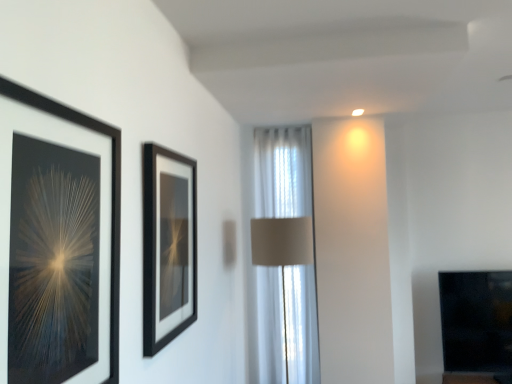
This screenshot has height=384, width=512. What do you see at coordinates (477, 322) in the screenshot? I see `black glass fireplace at lower right` at bounding box center [477, 322].

Measure the distance between point (469, 369) and camera.

Point (469, 369) is 3.05 meters from camera.

What do you see at coordinates (168, 246) in the screenshot? The width and height of the screenshot is (512, 384). I see `black matte picture frame at center, which is the 1th picture frame from right to left` at bounding box center [168, 246].

You are a GUI agent. You are given a task and a screenshot of the screen. Output one action in this format:
    pyautogui.click(x=<x>, y=<y>)
    Task: Click on the black matte picture frame at center, which is the 2th picture frame from left to right
    
    Given the screenshot: What is the action you would take?
    168,246

The width and height of the screenshot is (512, 384). Find the location of `black matte picture frame at left, placed as the first picture frame when sorted from front to back`. black matte picture frame at left, placed as the first picture frame when sorted from front to back is located at coordinates (57, 242).

Identify the location of white sheer curtain at center. (283, 172).

Identify the location of black glass fireplace at lower right. Image resolution: width=512 pixels, height=384 pixels. (477, 322).

Is white sheer curtain at center not close to black matte picture frame at left, the 1th picture frame positioned from the left?

Yes, white sheer curtain at center and black matte picture frame at left, the 1th picture frame positioned from the left, are quite far apart.

From a real-world perspective, which is physically below, white sheer curtain at center or black matte picture frame at left, the 1th picture frame positioned from the left?

In real-world perspective, white sheer curtain at center is lower.

Could you tell me if white sheer curtain at center is turned towards black matte picture frame at left, marked as the second picture frame in a back-to-front arrangement?

Yes, white sheer curtain at center is turned towards black matte picture frame at left, marked as the second picture frame in a back-to-front arrangement.

Can you confirm if white sheer curtain at center is wider than black matte picture frame at center, which is the 2th picture frame from left to right?

Indeed, white sheer curtain at center has a greater width compared to black matte picture frame at center, which is the 2th picture frame from left to right.

In the scene shown: Is white sheer curtain at center placed right next to black matte picture frame at center, which is the 2th picture frame from left to right?

No, white sheer curtain at center is not making contact with black matte picture frame at center, which is the 2th picture frame from left to right.

Is white sheer curtain at center closer to camera compared to black matte picture frame at center, which is the 2th picture frame from left to right?

No, white sheer curtain at center is further to the viewer.

Looking at this image, from a real-world perspective, is black glass fireplace at lower right on white sheer curtain at center?

No.

Is white sheer curtain at center at the back of black glass fireplace at lower right?

No.

Is black glass fireplace at lower right positioned beyond the bounds of white sheer curtain at center?

black glass fireplace at lower right lies outside white sheer curtain at center's area.

How distant is black glass fireplace at lower right from white sheer curtain at center?

black glass fireplace at lower right is 1.23 meters from white sheer curtain at center.

Is black matte picture frame at center, which is the 2th picture frame from left to right, to the right of black glass fireplace at lower right from the viewer's perspective?

Incorrect, black matte picture frame at center, which is the 2th picture frame from left to right, is not on the right side of black glass fireplace at lower right.

Is black matte picture frame at center, which is the 2th picture frame from left to right, inside the boundaries of black glass fireplace at lower right, or outside?

black matte picture frame at center, which is the 2th picture frame from left to right, lies outside black glass fireplace at lower right.

Which of these two, black matte picture frame at center, placed as the first picture frame when sorted from back to front, or black glass fireplace at lower right, is thinner?

With smaller width is black matte picture frame at center, placed as the first picture frame when sorted from back to front.

From a real-world perspective, which object stands above the other?

In real-world perspective, black matte picture frame at center, the 2th picture frame in the front-to-back sequence, is above.

Is the depth of black matte picture frame at center, placed as the first picture frame when sorted from back to front, greater than that of white sheer curtain at center?

That is False.

Can you confirm if black matte picture frame at center, the 2th picture frame in the front-to-back sequence, is taller than white sheer curtain at center?

No.

From the image's perspective, is black glass fireplace at lower right below black matte picture frame at center, the 2th picture frame in the front-to-back sequence?

Indeed, from the image's perspective, black glass fireplace at lower right is shown beneath black matte picture frame at center, the 2th picture frame in the front-to-back sequence.

Considering the positions of objects black glass fireplace at lower right and black matte picture frame at center, placed as the first picture frame when sorted from back to front, in the image provided, who is behind, black glass fireplace at lower right or black matte picture frame at center, placed as the first picture frame when sorted from back to front,?

Positioned behind is black glass fireplace at lower right.

Does black glass fireplace at lower right have a smaller size compared to black matte picture frame at center, which is the 2th picture frame from left to right?

Actually, black glass fireplace at lower right might be larger than black matte picture frame at center, which is the 2th picture frame from left to right.

From the picture: Is black glass fireplace at lower right aimed at black matte picture frame at center, which is the 1th picture frame from right to left?

No, black glass fireplace at lower right is not oriented towards black matte picture frame at center, which is the 1th picture frame from right to left.

Between black glass fireplace at lower right and black matte picture frame at left, the 1th picture frame positioned from the left, which one has more height?

black glass fireplace at lower right.

Is black glass fireplace at lower right located outside black matte picture frame at left, the 1th picture frame positioned from the left?

Absolutely, black glass fireplace at lower right is external to black matte picture frame at left, the 1th picture frame positioned from the left.

From a real-world perspective, is black glass fireplace at lower right under black matte picture frame at left, placed as the first picture frame when sorted from front to back?

Yes, from a real-world perspective, black glass fireplace at lower right is under black matte picture frame at left, placed as the first picture frame when sorted from front to back.

Could you measure the distance between black glass fireplace at lower right and black matte picture frame at left, the 1th picture frame positioned from the left?

They are 9.27 feet apart.

Where is `picture frame that is the 2nd object to the left of the white sheer curtain at center, starting at the anchor`? This screenshot has height=384, width=512. picture frame that is the 2nd object to the left of the white sheer curtain at center, starting at the anchor is located at coordinates (57, 242).

From the white sheer curtain at center, count 1st picture frames forward and point to it. Please provide its 2D coordinates.

[(168, 246)]

When comparing their distances from black matte picture frame at center, which is the 1th picture frame from right to left, does black glass fireplace at lower right or white sheer curtain at center seem closer?

white sheer curtain at center is closer to black matte picture frame at center, which is the 1th picture frame from right to left.

Based on their spatial positions, is black matte picture frame at center, which is the 2th picture frame from left to right, or black matte picture frame at left, the 1th picture frame positioned from the left, closer to black glass fireplace at lower right?

Among the two, black matte picture frame at center, which is the 2th picture frame from left to right, is located nearer to black glass fireplace at lower right.

Which object lies further to the anchor point black glass fireplace at lower right, white sheer curtain at center or black matte picture frame at left, the second picture frame from the right?

Among the two, black matte picture frame at left, the second picture frame from the right, is located further to black glass fireplace at lower right.

Which object lies nearer to the anchor point black matte picture frame at left, the second picture frame from the right, black glass fireplace at lower right or black matte picture frame at center, placed as the first picture frame when sorted from back to front?

Based on the image, black matte picture frame at center, placed as the first picture frame when sorted from back to front, appears to be nearer to black matte picture frame at left, the second picture frame from the right.

Which object lies nearer to the anchor point black glass fireplace at lower right, white sheer curtain at center or black matte picture frame at center, the 2th picture frame in the front-to-back sequence?

white sheer curtain at center is closer to black glass fireplace at lower right.

Looking at the image, which one is located further to white sheer curtain at center, black matte picture frame at center, which is the 1th picture frame from right to left, or black matte picture frame at left, placed as the first picture frame when sorted from front to back?

black matte picture frame at left, placed as the first picture frame when sorted from front to back, is positioned further to the anchor white sheer curtain at center.

Which object lies nearer to the anchor point black glass fireplace at lower right, black matte picture frame at center, the 2th picture frame in the front-to-back sequence, or white sheer curtain at center?

Based on the image, white sheer curtain at center appears to be nearer to black glass fireplace at lower right.

From the image, which object appears to be nearer to black matte picture frame at center, which is the 2th picture frame from left to right, white sheer curtain at center or black glass fireplace at lower right?

Among the two, white sheer curtain at center is located nearer to black matte picture frame at center, which is the 2th picture frame from left to right.

At what (x,y) coordinates should I click in order to perform the action: click on picture frame between black matte picture frame at left, marked as the second picture frame in a back-to-front arrangement, and white sheer curtain at center, along the z-axis. Please return your answer as a coordinate pair (x, y). Looking at the image, I should click on (168, 246).

Identify the location of picture frame between black matte picture frame at left, the 1th picture frame positioned from the left, and black glass fireplace at lower right, in the horizontal direction. The image size is (512, 384). (168, 246).

This screenshot has height=384, width=512. Identify the location of fireplace positioned between black matte picture frame at left, the 1th picture frame positioned from the left, and white sheer curtain at center from near to far. (477, 322).

Identify the location of fireplace between black matte picture frame at center, placed as the first picture frame when sorted from back to front, and white sheer curtain at center in the front-back direction. This screenshot has width=512, height=384. (477, 322).